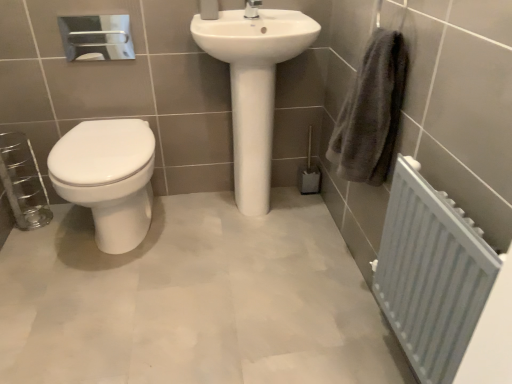
This screenshot has height=384, width=512. I want to click on free location in front of white glossy toilet at left, so click(x=97, y=303).